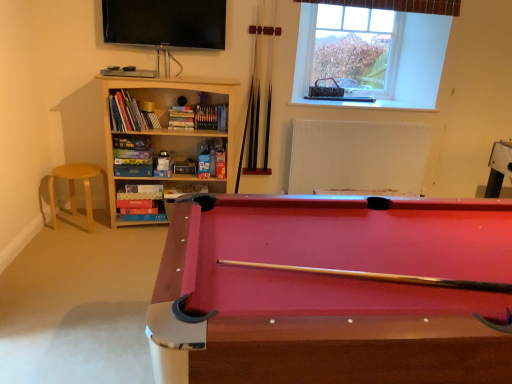
Locate an element on the screen. free spot above white matte radiator at upper center (from a real-world perspective) is located at coordinates (347, 113).